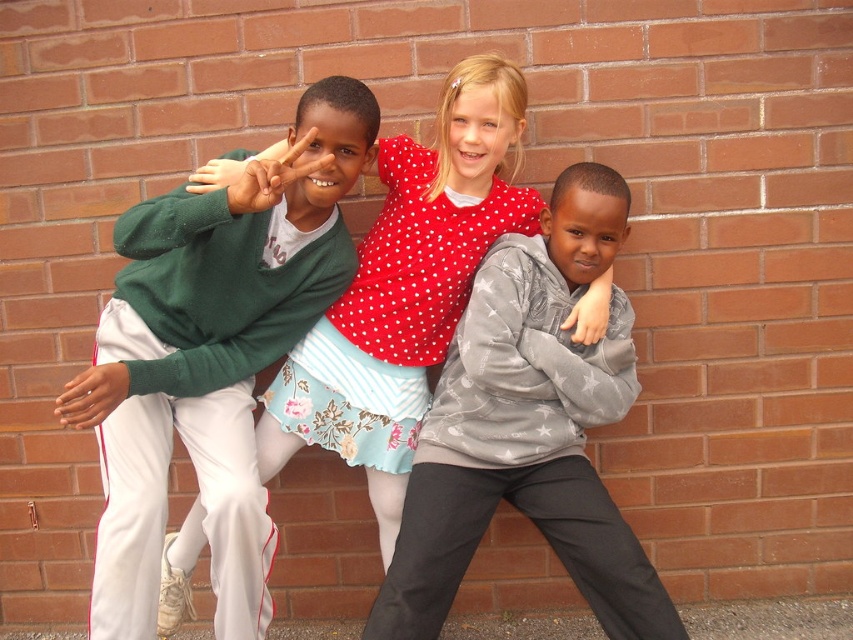
You are a photographer taking a picture of the children. You notice the green sweater at left and the polka dot fabric dress at center. Which clothing item is covering part of the other?

The green sweater at left is positioned over the polka dot fabric dress at center, so it is covering part of it.

You are a photographer trying to capture a clear photo of the gray velvety sweatshirt at center and the polka dot fabric dress at center. Which one will appear closer to the camera in the photo?

The gray velvety sweatshirt at center will appear closer to the camera because it is in front of the polka dot fabric dress at center.

In the scene shown: You are a photographer trying to capture a group photo of the gray velvety sweatshirt at center and the polka dot fabric dress at center. Which clothing item should you focus on first if you want to ensure both are in frame without moving the camera? Please explain your reasoning based on their sizes.

The gray velvety sweatshirt at center has a lesser width compared to the polka dot fabric dress at center. Therefore, you should focus on the polka dot fabric dress at center first since it is wider and might require more space in the frame. By centering the wider dress, you can adjust the camera angle to include the narrower sweatshirt without needing to move the camera position.